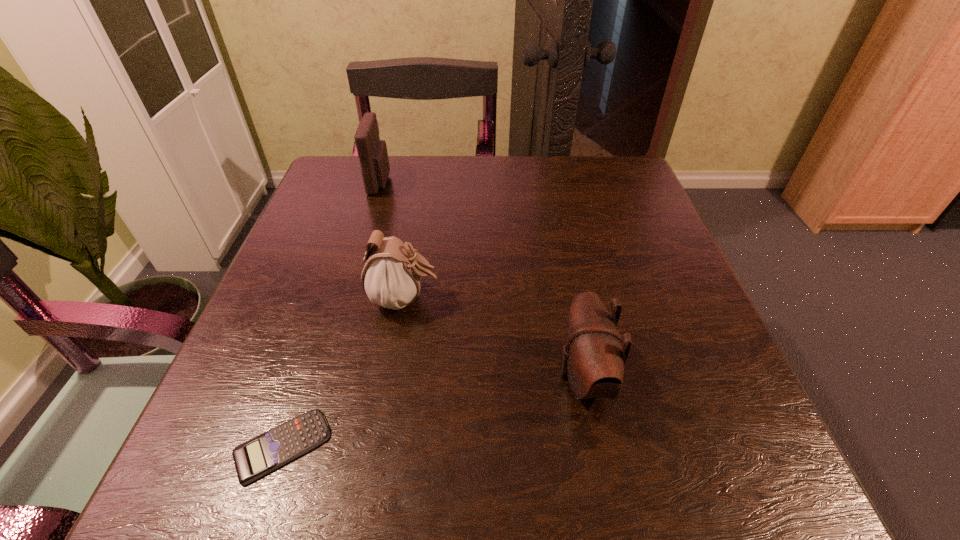
This screenshot has height=540, width=960. I want to click on the farthest pouch, so click(372, 152).

Find the location of a particular element. Image resolution: width=960 pixels, height=540 pixels. the farthest object is located at coordinates (372, 152).

Where is `the third object from left to right`? The height and width of the screenshot is (540, 960). the third object from left to right is located at coordinates (391, 277).

Where is `the second farthest object`? The image size is (960, 540). the second farthest object is located at coordinates (391, 277).

Find the location of a particular element. The image size is (960, 540). the nearest pouch is located at coordinates (595, 361).

Find the location of a particular element. This screenshot has height=540, width=960. the rightmost object is located at coordinates (595, 361).

Locate an element on the screen. This screenshot has height=540, width=960. the shortest object is located at coordinates (253, 459).

At what (x,y) coordinates should I click in order to perform the action: click on free space located with an open flap on the farthest object. Please return your answer as a coordinate pair (x, y). Image resolution: width=960 pixels, height=540 pixels. Looking at the image, I should click on (440, 183).

Find the location of a particular element. free space located on the front-facing side of the second farthest pouch is located at coordinates (612, 299).

At what (x,y) coordinates should I click in order to perform the action: click on vacant area located 0.300m with the flap open on the nearest pouch. Please return your answer as a coordinate pair (x, y). Looking at the image, I should click on (364, 376).